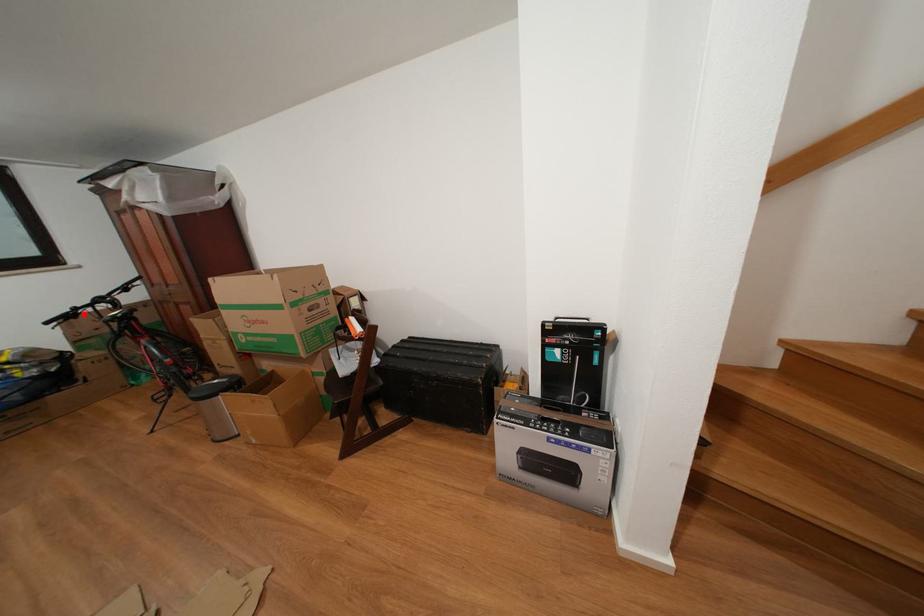
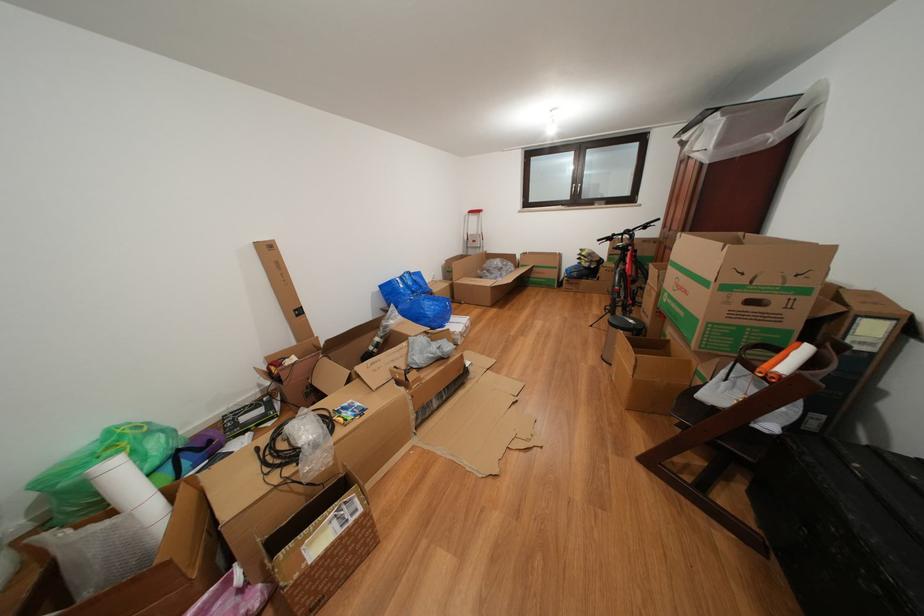
Question: I am providing you with two images of the same scene from different viewpoints. A red point is shown in image1. For the corresponding object point in image2, is it positioned nearer or farther from the camera?

Choices:
 (A) Nearer
 (B) Farther

Answer: (A)